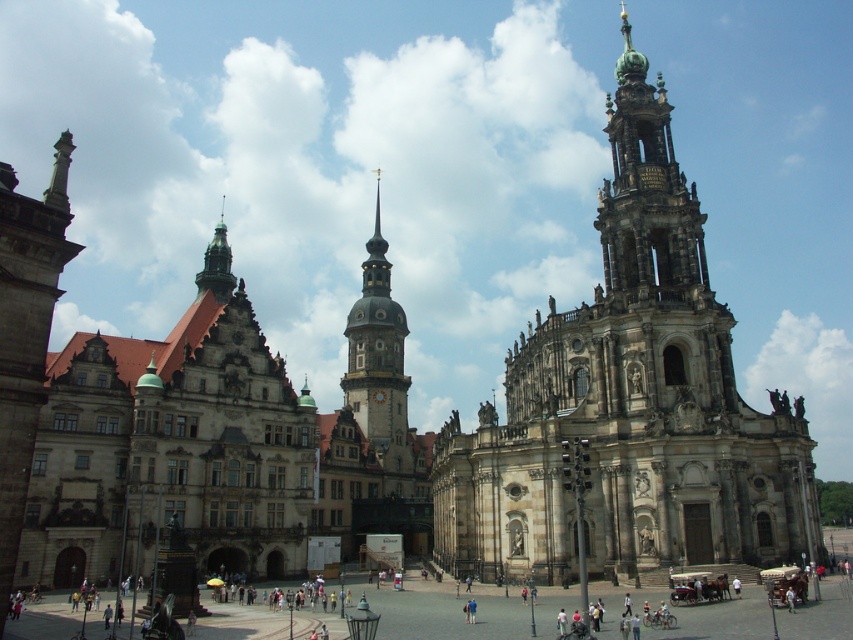
Question: Which of the following is the closest to the observer?

Choices:
 (A) (363, 355)
 (B) (700, 611)
 (C) (19, 429)

Answer: (C)

Question: Is stone tower at center behind stone column at left?

Choices:
 (A) yes
 (B) no

Answer: (A)

Question: In this image, where is stone paved square at center located relative to stone column at left?

Choices:
 (A) below
 (B) above

Answer: (A)

Question: Which of the following is the farthest from the observer?

Choices:
 (A) stone column at left
 (B) stone tower at center
 (C) stone spire at center

Answer: (C)

Question: In this image, where is stone paved square at center located relative to stone column at left?

Choices:
 (A) right
 (B) left

Answer: (A)

Question: Which object is farther from the camera taking this photo?

Choices:
 (A) stone tower at center
 (B) stone paved square at center
 (C) stone spire at center
 (D) stone column at left

Answer: (C)